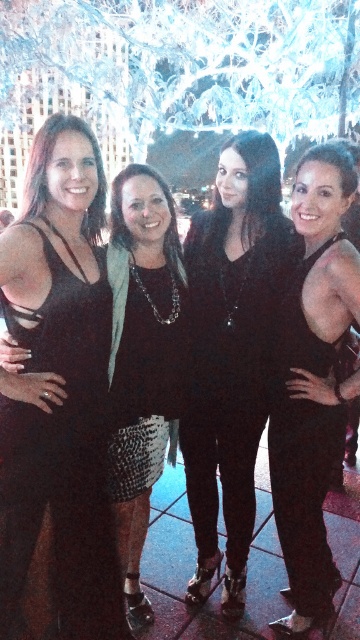
What is located at the coordinates point (231, 353)?

The black leather dress at center is located at point (231, 353).

You are a photographer trying to capture a group photo of the women in the image. You want to ensure that both the black leather dress at center and the black textured dress at left are clearly visible in the frame. Given their sizes, which dress should you focus on first to ensure proper exposure?

The black leather dress at center is smaller than the black textured dress at left, so you should focus on the black textured dress at left first to ensure proper exposure since it is larger and might require more attention for details.